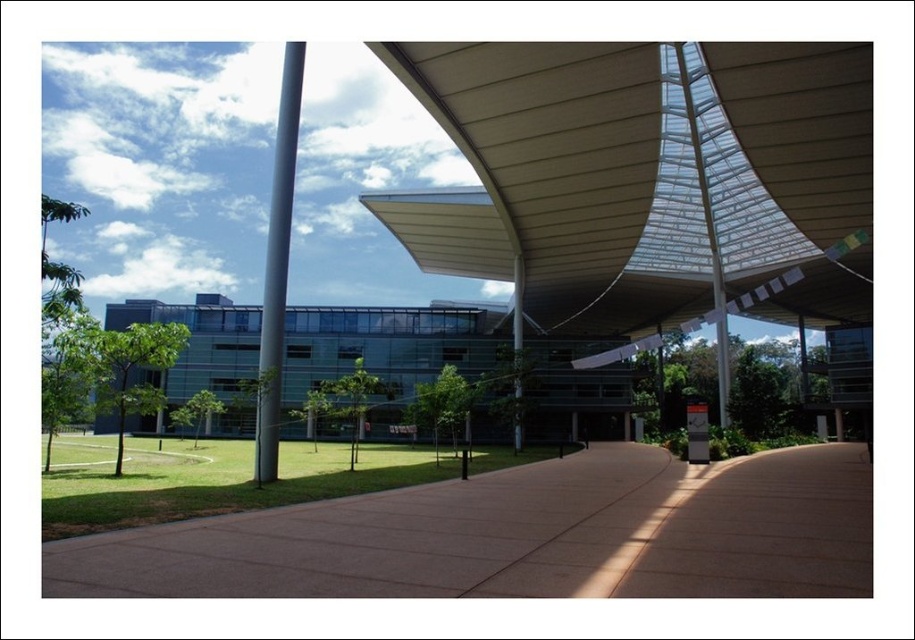
Who is lower down, white textured canopy at upper center or metallic pole at center?

metallic pole at center

Does white textured canopy at upper center have a greater height compared to metallic pole at center?

No, white textured canopy at upper center is not taller than metallic pole at center.

Is point (534, 291) positioned after point (514, 272)?

Yes.

Locate an element on the screen. The width and height of the screenshot is (915, 640). white textured canopy at upper center is located at coordinates (644, 173).

Based on the photo, is white textured canopy at upper center taller than brown concrete pavement at center?

Yes, white textured canopy at upper center is taller than brown concrete pavement at center.

In the scene shown: Which is more to the right, white textured canopy at upper center or brown concrete pavement at center?

From the viewer's perspective, white textured canopy at upper center appears more on the right side.

Is point (716, 150) behind point (289, 512)?

Yes.

The height and width of the screenshot is (640, 915). Identify the location of white textured canopy at upper center. (644, 173).

Does satin silver pole at center have a greater width compared to metallic pole at center?

Yes, satin silver pole at center is wider than metallic pole at center.

Does satin silver pole at center appear on the left side of metallic pole at center?

Correct, you'll find satin silver pole at center to the left of metallic pole at center.

Is point (273, 177) farther from camera compared to point (515, 358)?

That is False.

What are the coordinates of `satin silver pole at center` in the screenshot? It's located at (277, 266).